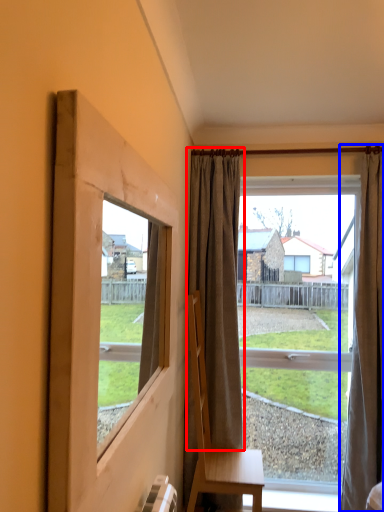
Question: Which object is closer to the camera taking this photo, curtain (highlighted by a red box) or curtain (highlighted by a blue box)?

Choices:
 (A) curtain
 (B) curtain

Answer: (B)